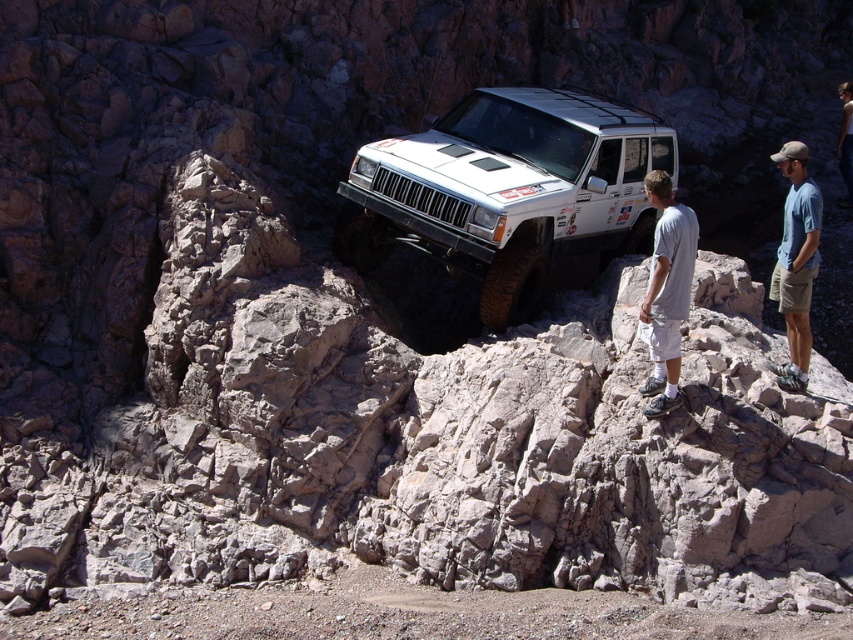
Question: Which point appears farthest from the camera in this image?

Choices:
 (A) (643, 300)
 (B) (526, 97)
 (C) (798, 294)

Answer: (B)

Question: Does white cotton shorts at lower right have a lesser width compared to blue cotton shirt at right?

Choices:
 (A) yes
 (B) no

Answer: (A)

Question: Is white cotton shorts at lower right to the right of blue cotton shirt at right from the viewer's perspective?

Choices:
 (A) no
 (B) yes

Answer: (A)

Question: Which point is farther to the camera?

Choices:
 (A) white cotton shorts at lower right
 (B) blue cotton shirt at right
 (C) white matte suv at center

Answer: (C)

Question: Can you confirm if white matte suv at center is thinner than white cotton shorts at lower right?

Choices:
 (A) no
 (B) yes

Answer: (A)

Question: Estimate the real-world distances between objects in this image. Which object is closer to the blue cotton shirt at right?

Choices:
 (A) white matte suv at center
 (B) white cotton shorts at lower right

Answer: (B)